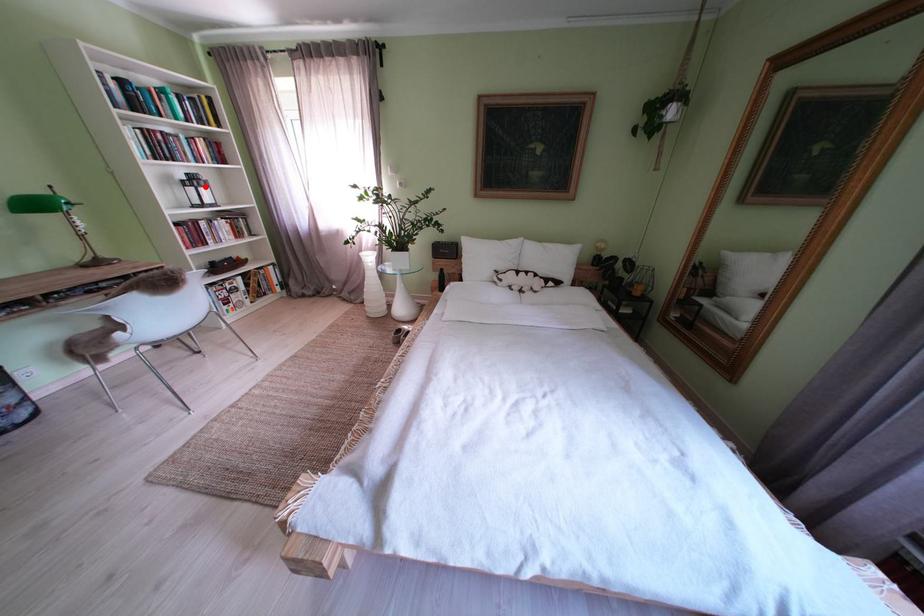
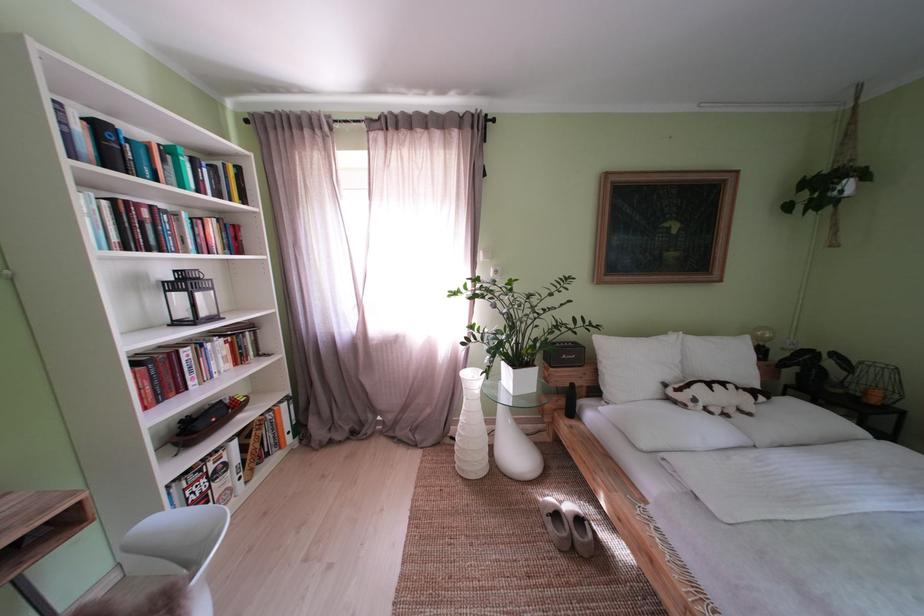
In the second image, find the point that corresponds to the highlighted location in the first image.

(198, 286)